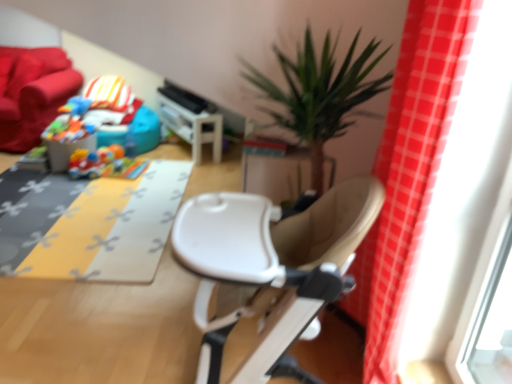
Locate an element on the screen. Image resolution: width=512 pixels, height=384 pixels. red plaid curtain at right is located at coordinates (411, 166).

This screenshot has width=512, height=384. What are the coordinates of `white plastic table at center` in the screenshot? It's located at (192, 127).

The width and height of the screenshot is (512, 384). What are the coordinates of `plastic colorful car at center, marked as the first toy in a bottom-to-top arrangement` in the screenshot? It's located at (104, 164).

Locate an element on the screen. This screenshot has height=384, width=512. white plastic chair at center is located at coordinates (269, 259).

Find the location of a particular element. The image size is (512, 384). velvet red couch at upper left is located at coordinates (33, 93).

From a real-world perspective, is yellow fabric mat at center above or below plastic colorful car at center, marked as the second toy in a top-to-bottom arrangement?

yellow fabric mat at center is situated lower than plastic colorful car at center, marked as the second toy in a top-to-bottom arrangement, in the real world.

Which is in front, yellow fabric mat at center or plastic colorful car at center, arranged as the 2th toy when viewed from the left?

yellow fabric mat at center is in front.

Can you confirm if yellow fabric mat at center is smaller than plastic colorful car at center, marked as the first toy in a bottom-to-top arrangement?

Incorrect, yellow fabric mat at center is not smaller in size than plastic colorful car at center, marked as the first toy in a bottom-to-top arrangement.

Considering the sizes of objects white plastic table at center and yellow fabric mat at center in the image provided, who is taller, white plastic table at center or yellow fabric mat at center?

white plastic table at center.

Between white plastic table at center and yellow fabric mat at center, which one is positioned in front?

yellow fabric mat at center is in front.

From a real-world perspective, which object rests below the other?

In real-world perspective, yellow fabric mat at center is lower.

Image resolution: width=512 pixels, height=384 pixels. I want to click on table on the right of yellow fabric mat at center, so click(x=192, y=127).

Considering the sizes of objects rubberized blue toy at upper left, the 2th toy in the right-to-left sequence, and white plastic chair at center in the image provided, who is taller, rubberized blue toy at upper left, the 2th toy in the right-to-left sequence, or white plastic chair at center?

Standing taller between the two is white plastic chair at center.

Is rubberized blue toy at upper left, the 2th toy from the bottom, surrounding white plastic chair at center?

No, white plastic chair at center is not inside rubberized blue toy at upper left, the 2th toy from the bottom.

Are rubberized blue toy at upper left, positioned as the 1th toy in top-to-bottom order, and white plastic chair at center making contact?

They are not placed beside each other.

Does white plastic table at center turn towards velvet red couch at upper left?

Yes, white plastic table at center faces towards velvet red couch at upper left.

Between white plastic table at center and velvet red couch at upper left, which one is positioned behind?

white plastic table at center is further away from the camera.

Does white plastic table at center appear on the right side of velvet red couch at upper left?

Yes.

Can you tell me how much white plastic table at center and velvet red couch at upper left differ in facing direction?

146 degrees.

Is plastic colorful car at center, marked as the second toy in a top-to-bottom arrangement, completely or partially inside white plastic chair at center?

No, plastic colorful car at center, marked as the second toy in a top-to-bottom arrangement, is not surrounded by white plastic chair at center.

Is plastic colorful car at center, marked as the second toy in a top-to-bottom arrangement, at the back of white plastic chair at center?

white plastic chair at center does not have its back to plastic colorful car at center, marked as the second toy in a top-to-bottom arrangement.

From a real-world perspective, is white plastic chair at center positioned above or below plastic colorful car at center, arranged as the 2th toy when viewed from the left?

white plastic chair at center is situated higher than plastic colorful car at center, arranged as the 2th toy when viewed from the left, in the real world.

Is white plastic chair at center beside plastic colorful car at center, marked as the second toy in a top-to-bottom arrangement?

white plastic chair at center is not next to plastic colorful car at center, marked as the second toy in a top-to-bottom arrangement, and they're not touching.

What's the angular difference between white plastic chair at center and rubberized blue toy at upper left, the 2th toy in the right-to-left sequence,'s facing directions?

There is a 79.6-degree angle between the facing directions of white plastic chair at center and rubberized blue toy at upper left, the 2th toy in the right-to-left sequence.

Between white plastic chair at center and rubberized blue toy at upper left, positioned as the 1th toy in top-to-bottom order, which one has larger size?

With larger size is white plastic chair at center.

Considering the relative sizes of white plastic chair at center and rubberized blue toy at upper left, the 2th toy in the right-to-left sequence, in the image provided, is white plastic chair at center taller than rubberized blue toy at upper left, the 2th toy in the right-to-left sequence,?

Yes.

From the picture: From a real-world perspective, is white plastic chair at center positioned under rubberized blue toy at upper left, positioned as the 1th toy in top-to-bottom order, based on gravity?

No, from a real-world perspective, white plastic chair at center is not beneath rubberized blue toy at upper left, positioned as the 1th toy in top-to-bottom order.

Which is closer to the camera, (79,106) or (67,73)?

The point (79,106) is more forward.

Between rubberized blue toy at upper left, positioned as the 1th toy in top-to-bottom order, and velvet red couch at upper left, which one has smaller size?

Smaller between the two is rubberized blue toy at upper left, positioned as the 1th toy in top-to-bottom order.

From a real-world perspective, which is physically below, rubberized blue toy at upper left, positioned as the 1th toy in top-to-bottom order, or velvet red couch at upper left?

velvet red couch at upper left.

Does rubberized blue toy at upper left, marked as the 1th toy in a left-to-right arrangement, appear on the left side of velvet red couch at upper left?

In fact, rubberized blue toy at upper left, marked as the 1th toy in a left-to-right arrangement, is to the right of velvet red couch at upper left.

This screenshot has height=384, width=512. What are the coordinates of `the 1st toy behind the yellow fabric mat at center, starting your count from the anchor` in the screenshot? It's located at (104, 164).

Locate an element on the screen. The width and height of the screenshot is (512, 384). mat below the white plastic table at center (from the image's perspective) is located at coordinates (92, 225).

Which object lies nearer to the anchor point rubberized blue toy at upper left, the 2th toy from the bottom, white plastic table at center or white plastic chair at center?

Based on the image, white plastic table at center appears to be nearer to rubberized blue toy at upper left, the 2th toy from the bottom.

From the image, which object appears to be farther from white plastic chair at center, rubberized blue toy at upper left, marked as the 1th toy in a left-to-right arrangement, or white plastic table at center?

Among the two, rubberized blue toy at upper left, marked as the 1th toy in a left-to-right arrangement, is located further to white plastic chair at center.

Which object lies further to the anchor point velvet red couch at upper left, red plaid curtain at right or rubberized blue toy at upper left, positioned as the 1th toy in top-to-bottom order?

red plaid curtain at right.

From the image, which object appears to be nearer to red plaid curtain at right, velvet red couch at upper left or white plastic table at center?

The object closer to red plaid curtain at right is white plastic table at center.

When comparing their distances from velvet red couch at upper left, does yellow fabric mat at center or red plaid curtain at right seem closer?

Among the two, yellow fabric mat at center is located nearer to velvet red couch at upper left.

From the image, which object appears to be nearer to white plastic table at center, white plastic chair at center or red plaid curtain at right?

white plastic chair at center is positioned closer to the anchor white plastic table at center.

Looking at the image, which one is located closer to plastic colorful car at center, which is the first toy from right to left, white plastic table at center or yellow fabric mat at center?

yellow fabric mat at center is closer to plastic colorful car at center, which is the first toy from right to left.

Based on their spatial positions, is velvet red couch at upper left or white plastic chair at center further from white plastic table at center?

white plastic chair at center lies further to white plastic table at center than the other object.

Identify the location of mat between red plaid curtain at right and plastic colorful car at center, marked as the first toy in a bottom-to-top arrangement, from front to back. This screenshot has width=512, height=384. (92, 225).

The image size is (512, 384). I want to click on mat between velvet red couch at upper left and white plastic chair at center, so click(92, 225).

Image resolution: width=512 pixels, height=384 pixels. What are the coordinates of `chair positioned between red plaid curtain at right and white plastic table at center from near to far` in the screenshot? It's located at (269, 259).

The width and height of the screenshot is (512, 384). In order to click on mat between white plastic chair at center and plastic colorful car at center, marked as the first toy in a bottom-to-top arrangement, along the z-axis in this screenshot , I will do `click(92, 225)`.